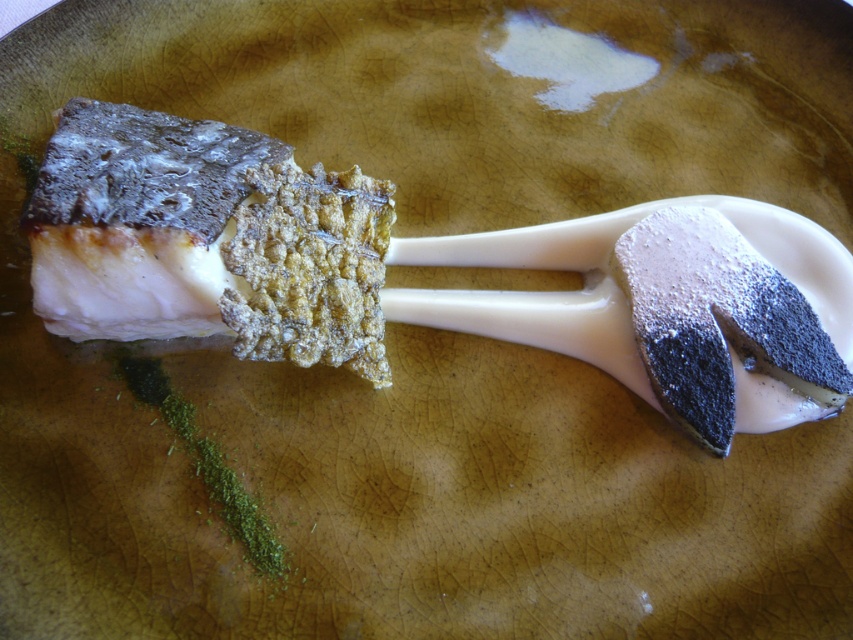
Question: Is white creamy fish at center above smooth white cream at center?

Choices:
 (A) yes
 (B) no

Answer: (A)

Question: Which object is closer to the camera taking this photo?

Choices:
 (A) smooth white cream at center
 (B) white creamy fish at center

Answer: (B)

Question: Can you confirm if white creamy fish at center is smaller than smooth white cream at center?

Choices:
 (A) no
 (B) yes

Answer: (A)

Question: Which of the following is the closest to the observer?

Choices:
 (A) white creamy fish at center
 (B) smooth white cream at center

Answer: (A)

Question: Considering the relative positions of white creamy fish at center and smooth white cream at center in the image provided, where is white creamy fish at center located with respect to smooth white cream at center?

Choices:
 (A) below
 (B) above

Answer: (B)